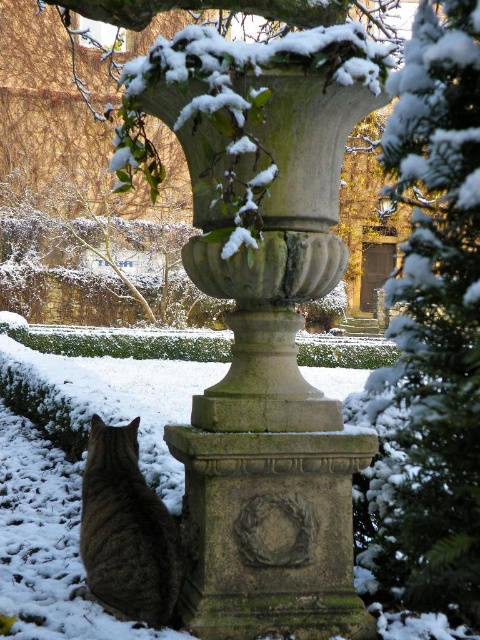
Who is lower down, snow-covered evergreen at right or tabby fur cat at lower left?

tabby fur cat at lower left

Who is positioned more to the left, snow-covered evergreen at right or tabby fur cat at lower left?

tabby fur cat at lower left

What do you see at coordinates (435, 320) in the screenshot? I see `snow-covered evergreen at right` at bounding box center [435, 320].

This screenshot has height=640, width=480. I want to click on snow-covered evergreen at right, so click(435, 320).